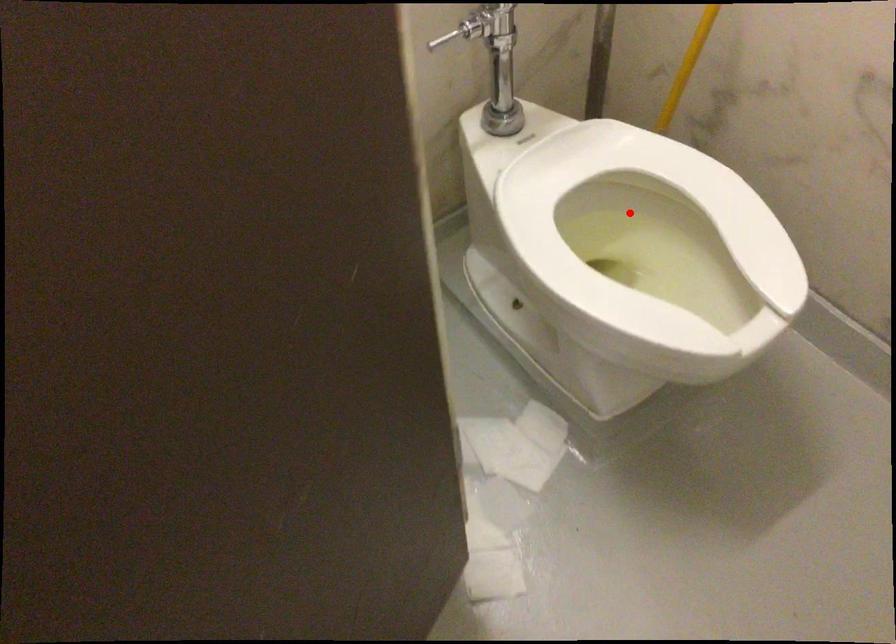
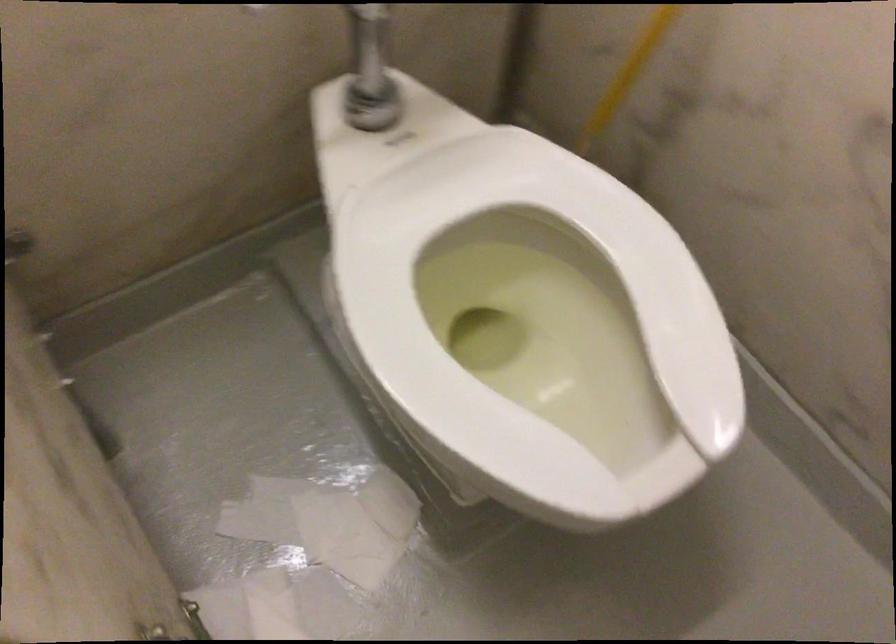
Question: I am providing you with two images of the same scene from different viewpoints. Given a red point in image1, look at the same physical point in image2. Is it:

Choices:
 (A) Closer to the viewpoint
 (B) Farther from the viewpoint

Answer: (A)